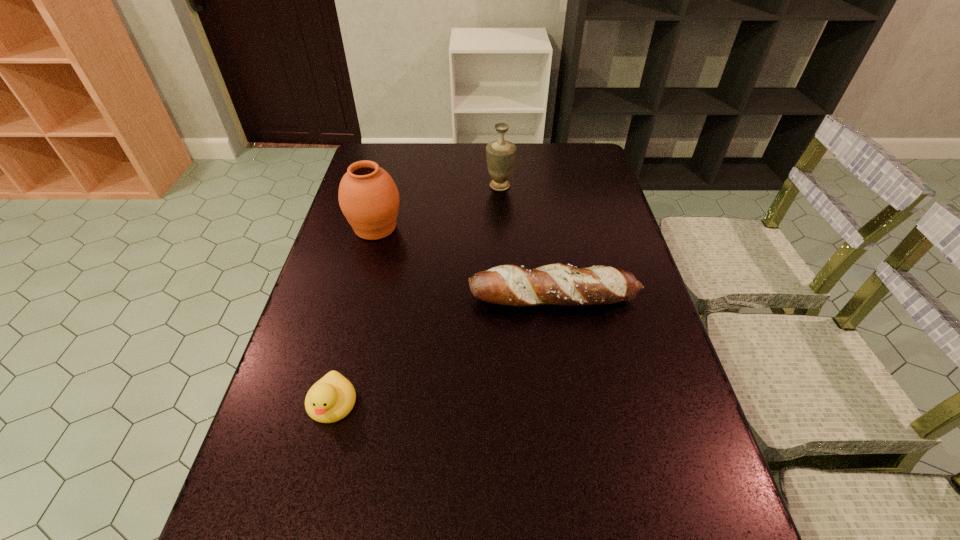
This screenshot has width=960, height=540. Find the location of `the farther urn`. the farther urn is located at coordinates (500, 154).

Where is `the right urn`? the right urn is located at coordinates (500, 154).

Image resolution: width=960 pixels, height=540 pixels. What are the coordinates of `the third nearest object` in the screenshot? It's located at (368, 196).

The width and height of the screenshot is (960, 540). In order to click on the left urn in this screenshot , I will do `click(368, 196)`.

You are a GUI agent. You are given a task and a screenshot of the screen. Output one action in this format:
    pyautogui.click(x=<x>, y=<y>)
    Task: Click on the third farthest object
    
    Given the screenshot: What is the action you would take?
    pyautogui.click(x=555, y=284)

Find the location of a particular element. the nearest object is located at coordinates (330, 399).

At what (x,y) coordinates should I click in order to perform the action: click on vacant space located 0.120m on the right of the farther urn. Please return your answer as a coordinate pair (x, y). Looking at the image, I should click on (549, 186).

Where is `free space located on the front of the nearer urn`? free space located on the front of the nearer urn is located at coordinates (368, 258).

Image resolution: width=960 pixels, height=540 pixels. In order to click on free space located 0.320m on the front of the baguet in this screenshot , I will do `click(576, 436)`.

The width and height of the screenshot is (960, 540). Identify the location of vacant space situated 0.100m on the face of the nearest object. coord(313,480).